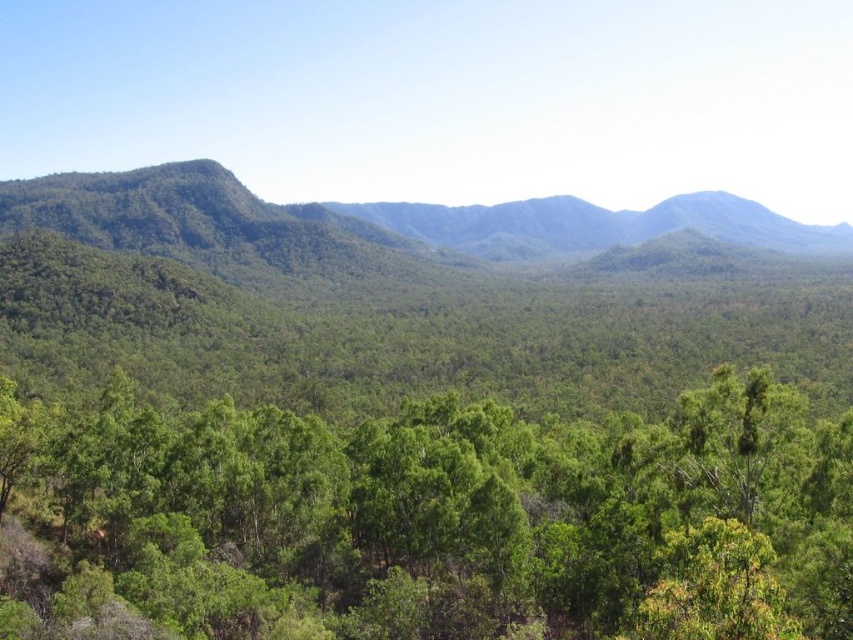
You are standing at the origin point in the landscape. Which direction should you walk to reach the green leafy tree at center?

The green leafy tree at center is located at point 0.814 on the x and 0.502 on the y, so you should walk towards the right and slightly forward to reach it.

You are a hiker standing in the lush landscape and want to reach the point at coordinates point [312,538] and point [122,268]. Which point should you head towards first if you want to reach the one that is closer to you?

You should head towards point [312,538] first because it is in front of point [122,268], meaning it is closer to your current position.